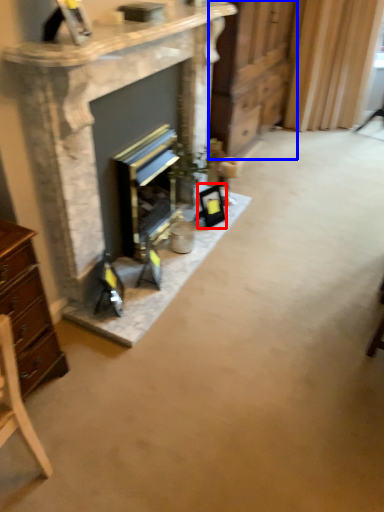
Question: Which object appears closest to the camera in this image, picture frame (highlighted by a red box) or dresser (highlighted by a blue box)?

Choices:
 (A) picture frame
 (B) dresser

Answer: (B)